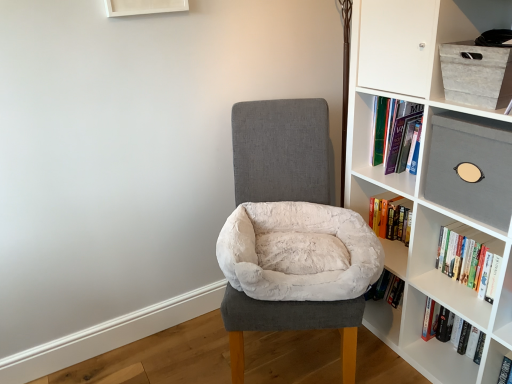
This screenshot has width=512, height=384. I want to click on vacant space situated above hardcover book at right, the 2th book from the bottom (from a real-world perspective), so click(476, 241).